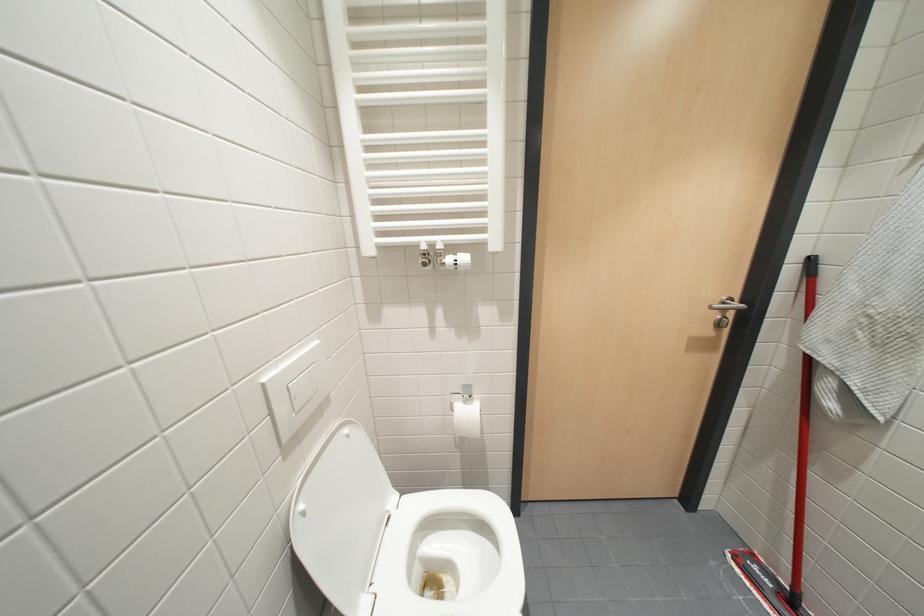
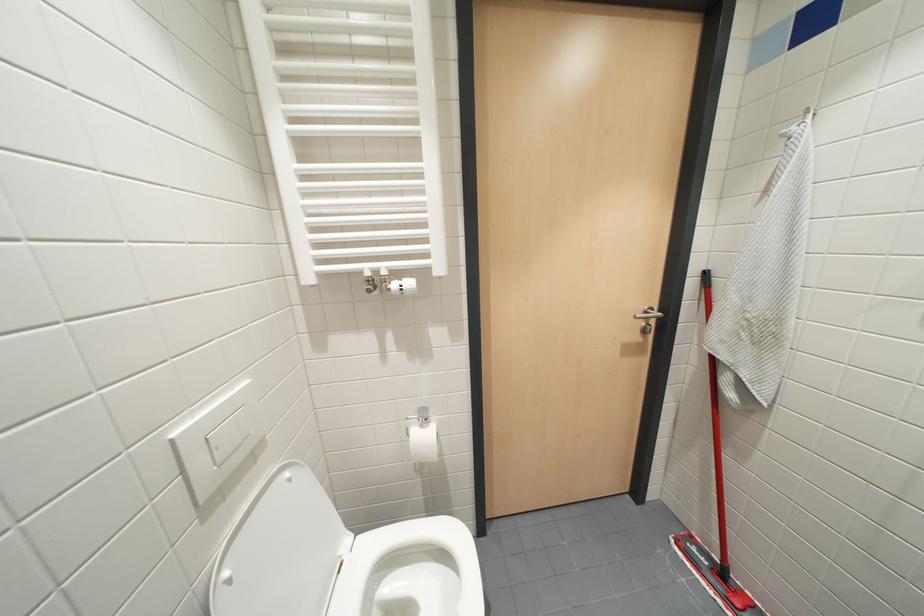
Question: In a continuous first-person perspective shot, in which direction is the camera moving?

Choices:
 (A) Left
 (B) Right
 (C) Forward
 (D) Backward

Answer: (B)